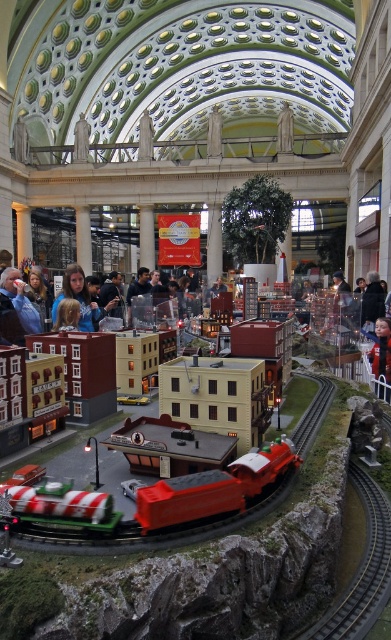
You are standing at the entrance of the model train display and want to walk towards the point labeled as point (66, 513). However, there is an obstacle at point (30, 326). Will you encounter the obstacle before reaching your destination?

Point (66, 513) is in front of point (30, 326), so you will encounter the obstacle at point (30, 326) before reaching your destination.

You are a visitor at the train display and want to place a small toy car between the shiny red train at center and the blue denim jacket at left. Can you fit it there?

The shiny red train at center might be wider than blue denim jacket at left, so there may not be enough space to fit the small toy car between them.

You are a model train enthusiast standing in the display area. You notice a metallic silver train track at lower right and a blonde hair at center. Which object is farther from you?

The metallic silver train track at lower right is farther from you than the blonde hair at center, as it is 73.69 feet away.